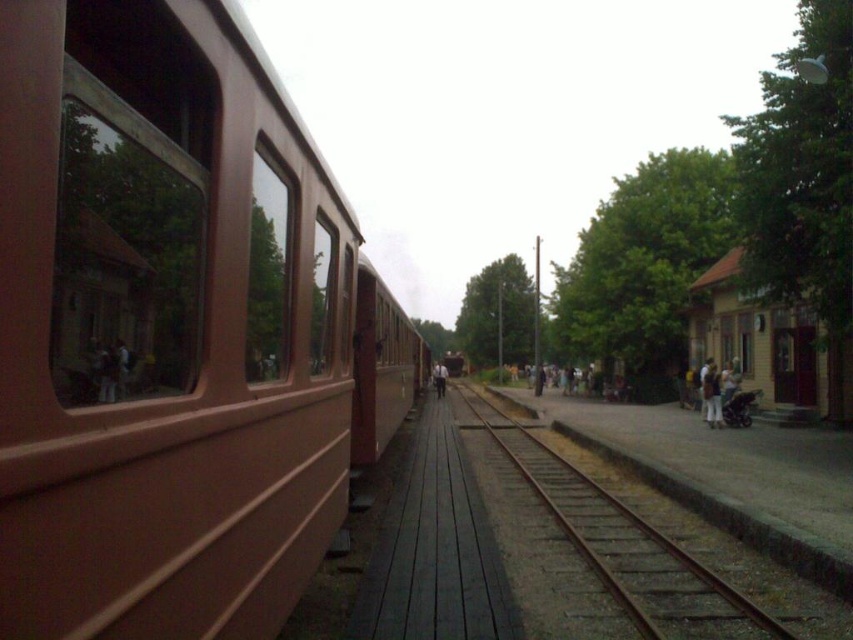
Question: Among these points, which one is nearest to the camera?

Choices:
 (A) (440, 387)
 (B) (711, 397)
 (C) (252, 307)
 (D) (170, 368)

Answer: (D)

Question: Is brown metal train track at center thinner than light brown leather jacket at center?

Choices:
 (A) no
 (B) yes

Answer: (A)

Question: Estimate the real-world distances between objects in this image. Which object is closer to the brown matte train at left?

Choices:
 (A) matte glass train window at left
 (B) light brown leather jacket at center

Answer: (A)

Question: Among these objects, which one is nearest to the camera?

Choices:
 (A) matte glass train window at left
 (B) light brown wooden bench at center
 (C) brown metal train track at center
 (D) light brown leather jacket at center

Answer: (A)

Question: Does matte glass train window at left come in front of light brown wooden bench at center?

Choices:
 (A) yes
 (B) no

Answer: (A)

Question: Can you confirm if light brown fabric pants at lower right is smaller than light brown leather jacket at center?

Choices:
 (A) no
 (B) yes

Answer: (B)